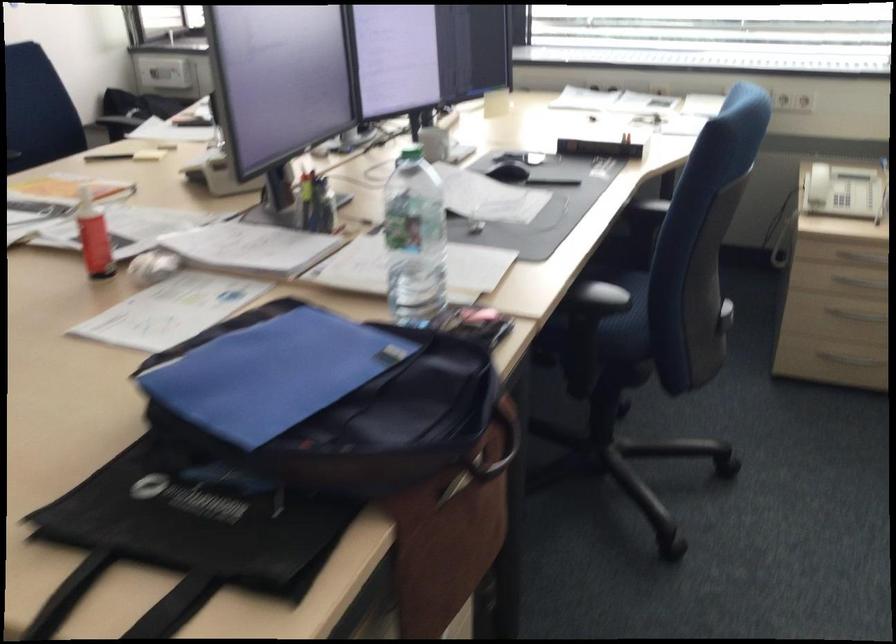
Where would you lift the black bag handle? Please return your answer as a coordinate pair (x, y).

(124, 601)